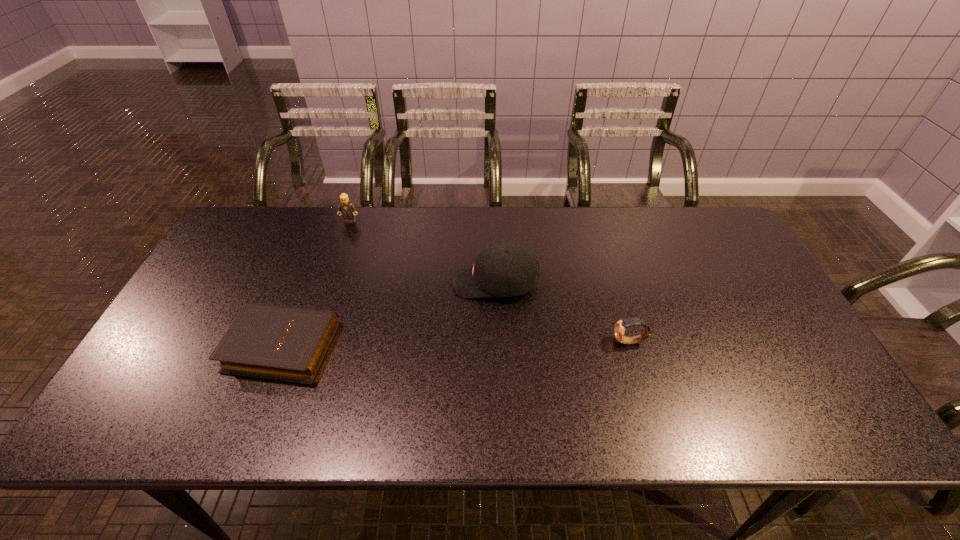
You are a GUI agent. You are given a task and a screenshot of the screen. Output one action in this format:
    pyautogui.click(x=<x>, y=<y>)
    Task: Click on the vacant space at the far right corner of the desktop
    The height and width of the screenshot is (540, 960).
    Given the screenshot: What is the action you would take?
    pyautogui.click(x=707, y=236)

Image resolution: width=960 pixels, height=540 pixels. Identify the location of free region at the near right corner. coord(822,426).

The width and height of the screenshot is (960, 540). I want to click on unoccupied position between the Bible and the rightmost object, so click(x=456, y=344).

Where is `free spot between the shortest object and the third tallest object`? free spot between the shortest object and the third tallest object is located at coordinates (456, 344).

The image size is (960, 540). Find the location of `vacant point located between the baseball cap and the second shortest object`. vacant point located between the baseball cap and the second shortest object is located at coordinates (563, 312).

This screenshot has height=540, width=960. I want to click on empty space between the second object from right to left and the second shortest object, so click(563, 312).

At what (x,y) coordinates should I click in order to perform the action: click on vacant space in between the watch and the shortest object. Please return your answer as a coordinate pair (x, y). The width and height of the screenshot is (960, 540). Looking at the image, I should click on [456, 344].

Locate an element on the screen. This screenshot has height=540, width=960. blank region between the third object from left to right and the Bible is located at coordinates (389, 315).

Find the location of a particular element. free space between the Bible and the third tallest object is located at coordinates (456, 344).

Choose which object is the nearest neighbor to the third tallest object. Please provide its 2D coordinates. Your answer should be formatted as a tuple, i.e. [(x, y)], where the tuple contains the x and y coordinates of a point satisfying the conditions above.

[(502, 270)]